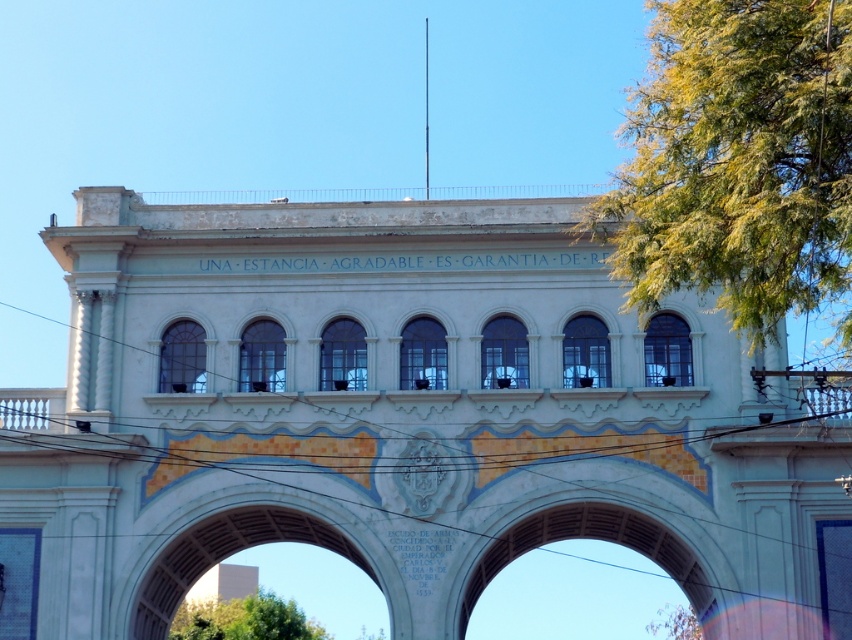
Is green leafy tree at upper right behind green leafy tree at lower right?

No, it is in front of green leafy tree at lower right.

Who is more distant from viewer, (699, 193) or (678, 612)?

The point (678, 612) is more distant.

What are the coordinates of `green leafy tree at upper right` in the screenshot? It's located at (737, 161).

Who is positioned more to the left, green leafy tree at upper right or white stone archway at center?

From the viewer's perspective, white stone archway at center appears more on the left side.

Does green leafy tree at upper right lie behind white stone archway at center?

No.

The height and width of the screenshot is (640, 852). I want to click on green leafy tree at upper right, so click(x=737, y=161).

Locate an element on the screen. green leafy tree at upper right is located at coordinates (737, 161).

Can you confirm if white stone archway at center is positioned above green leafy tree at lower center?

Yes, white stone archway at center is above green leafy tree at lower center.

Is point (268, 522) closer to viewer compared to point (235, 632)?

Yes, point (268, 522) is closer to viewer.

This screenshot has height=640, width=852. What do you see at coordinates (226, 556) in the screenshot?
I see `white stone archway at center` at bounding box center [226, 556].

Image resolution: width=852 pixels, height=640 pixels. In order to click on white stone archway at center in this screenshot , I will do [226, 556].